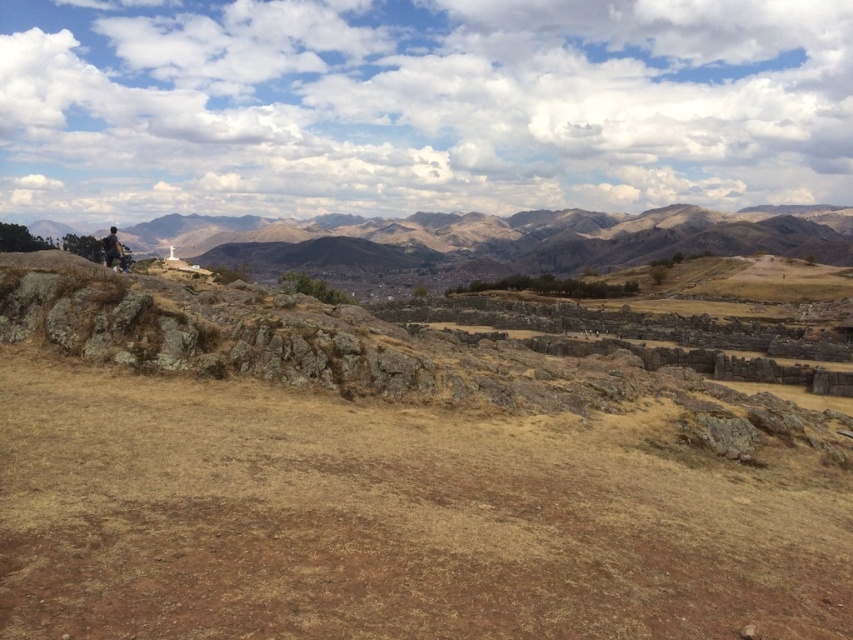
You are an archaeologist examining the landscape. You notice the brown rocky mountain at left and the dark brown stone statue at left. Based on their positions, which one is more to the east?

The brown rocky mountain at left and dark brown stone statue at left are both positioned at the left side of the image, so their eastward orientation cannot be determined based solely on their positions in the scene.